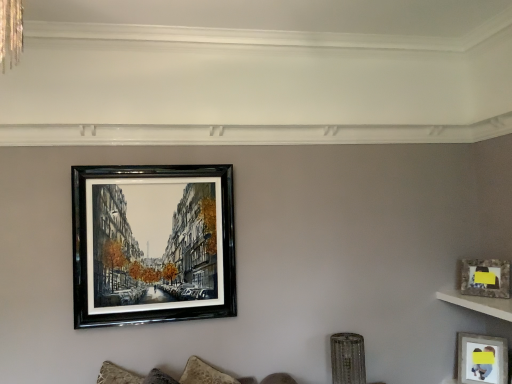
Describe the element at coordinates (485, 278) in the screenshot. This screenshot has width=512, height=384. I see `matte glass picture frame at upper right, the 2th picture frame in the left-to-right sequence` at that location.

This screenshot has width=512, height=384. What do you see at coordinates (482, 359) in the screenshot?
I see `matte gray picture frame at lower right, arranged as the third picture frame when viewed from the left` at bounding box center [482, 359].

The image size is (512, 384). What do you see at coordinates (152, 244) in the screenshot? I see `black glossy picture frame at upper center, the first picture frame positioned from the left` at bounding box center [152, 244].

This screenshot has width=512, height=384. Find the location of `white marble shelf at upper right`. white marble shelf at upper right is located at coordinates (479, 303).

Identify the location of matte glass picture frame at upper right, the second picture frame positioned from the bottom. The image size is (512, 384). (485, 278).

From the image's perspective, who appears lower, matte gray picture frame at lower right, which ranks as the 1th picture frame in bottom-to-top order, or black glossy picture frame at upper center, the 3th picture frame positioned from the bottom?

matte gray picture frame at lower right, which ranks as the 1th picture frame in bottom-to-top order, is shown below in the image.

Between matte gray picture frame at lower right, which ranks as the 3th picture frame in top-to-bottom order, and black glossy picture frame at upper center, the first picture frame from the top, which one appears on the right side from the viewer's perspective?

Positioned to the right is matte gray picture frame at lower right, which ranks as the 3th picture frame in top-to-bottom order.

Measure the distance between matte gray picture frame at lower right, which ranks as the 3th picture frame in top-to-bottom order, and black glossy picture frame at upper center, the 3th picture frame from the right.

matte gray picture frame at lower right, which ranks as the 3th picture frame in top-to-bottom order, and black glossy picture frame at upper center, the 3th picture frame from the right, are 6.75 feet apart.

Considering the positions of objects matte gray picture frame at lower right, arranged as the third picture frame when viewed from the left, and black glossy picture frame at upper center, the 3th picture frame positioned from the bottom, in the image provided, who is behind, matte gray picture frame at lower right, arranged as the third picture frame when viewed from the left, or black glossy picture frame at upper center, the 3th picture frame positioned from the bottom,?

matte gray picture frame at lower right, arranged as the third picture frame when viewed from the left, is further away from the camera.

Considering the sizes of matte gray picture frame at lower right, which ranks as the 1th picture frame in bottom-to-top order, and matte glass picture frame at upper right, the second picture frame positioned from the bottom, in the image, is matte gray picture frame at lower right, which ranks as the 1th picture frame in bottom-to-top order, wider or thinner than matte glass picture frame at upper right, the second picture frame positioned from the bottom,?

In the image, matte gray picture frame at lower right, which ranks as the 1th picture frame in bottom-to-top order, appears to be wider than matte glass picture frame at upper right, the second picture frame positioned from the bottom.

Is matte gray picture frame at lower right, which ranks as the 3th picture frame in top-to-bottom order, next to matte glass picture frame at upper right, placed as the 2th picture frame when sorted from right to left, and touching it?

There is a gap between matte gray picture frame at lower right, which ranks as the 3th picture frame in top-to-bottom order, and matte glass picture frame at upper right, placed as the 2th picture frame when sorted from right to left.

Is matte gray picture frame at lower right, which ranks as the 3th picture frame in top-to-bottom order, located outside matte glass picture frame at upper right, the 2th picture frame viewed from the top?

matte gray picture frame at lower right, which ranks as the 3th picture frame in top-to-bottom order, lies outside matte glass picture frame at upper right, the 2th picture frame viewed from the top,'s area.

Image resolution: width=512 pixels, height=384 pixels. In order to click on picture frame on the right of matte glass picture frame at upper right, the second picture frame positioned from the bottom in this screenshot , I will do `click(482, 359)`.

Is point (499, 266) positioned behind point (160, 176)?

Yes, it is behind point (160, 176).

Is matte glass picture frame at upper right, the 2th picture frame in the left-to-right sequence, further to camera compared to black glossy picture frame at upper center, the first picture frame positioned from the left?

Yes, matte glass picture frame at upper right, the 2th picture frame in the left-to-right sequence, is further from the viewer.

Considering the relative sizes of matte glass picture frame at upper right, the 2th picture frame viewed from the top, and black glossy picture frame at upper center, the 3th picture frame from the right, in the image provided, is matte glass picture frame at upper right, the 2th picture frame viewed from the top, thinner than black glossy picture frame at upper center, the 3th picture frame from the right,?

In fact, matte glass picture frame at upper right, the 2th picture frame viewed from the top, might be wider than black glossy picture frame at upper center, the 3th picture frame from the right.

Between black glossy picture frame at upper center, the 3th picture frame from the right, and matte glass picture frame at upper right, the 2th picture frame in the left-to-right sequence, which one appears on the right side from the viewer's perspective?

Positioned to the right is matte glass picture frame at upper right, the 2th picture frame in the left-to-right sequence.

From a real-world perspective, does black glossy picture frame at upper center, the first picture frame from the top, sit lower than matte glass picture frame at upper right, the 2th picture frame viewed from the top?

No, from a real-world perspective, black glossy picture frame at upper center, the first picture frame from the top, is not below matte glass picture frame at upper right, the 2th picture frame viewed from the top.

Is black glossy picture frame at upper center, the 3th picture frame from the right, completely or partially outside of matte glass picture frame at upper right, the 2th picture frame viewed from the top?

black glossy picture frame at upper center, the 3th picture frame from the right, lies outside matte glass picture frame at upper right, the 2th picture frame viewed from the top,'s area.

Is white marble shelf at upper right oriented away from matte gray picture frame at lower right, arranged as the third picture frame when viewed from the left?

No, white marble shelf at upper right's orientation is not away from matte gray picture frame at lower right, arranged as the third picture frame when viewed from the left.

Which point is more forward, (492, 307) or (475, 369)?

The point (492, 307) is closer to the camera.

From the image's perspective, between white marble shelf at upper right and matte gray picture frame at lower right, arranged as the third picture frame when viewed from the left, which one is located above?

white marble shelf at upper right appears higher in the image.

From the image's perspective, is matte glass picture frame at upper right, the 2th picture frame in the left-to-right sequence, located beneath white marble shelf at upper right?

No.

Looking at this image, which is in front, matte glass picture frame at upper right, the second picture frame positioned from the bottom, or white marble shelf at upper right?

white marble shelf at upper right is closer to the camera.

Which of these two, matte glass picture frame at upper right, the second picture frame positioned from the bottom, or white marble shelf at upper right, is wider?

white marble shelf at upper right is wider.

Does black glossy picture frame at upper center, the first picture frame positioned from the left, have a greater width compared to white marble shelf at upper right?

Incorrect, the width of black glossy picture frame at upper center, the first picture frame positioned from the left, does not surpass that of white marble shelf at upper right.

Could you tell me if black glossy picture frame at upper center, the 3th picture frame from the right, is turned towards white marble shelf at upper right?

No, black glossy picture frame at upper center, the 3th picture frame from the right, is not aimed at white marble shelf at upper right.

In order to click on the 2nd picture frame positioned below the black glossy picture frame at upper center, the first picture frame from the top (from the image's perspective) in this screenshot , I will do `click(482, 359)`.

There is a matte gray picture frame at lower right, arranged as the third picture frame when viewed from the left. What are the coordinates of `the 1st picture frame above it (from the image's perspective)` in the screenshot? It's located at (485, 278).

When comparing their distances from white marble shelf at upper right, does matte glass picture frame at upper right, placed as the 2th picture frame when sorted from right to left, or black glossy picture frame at upper center, the first picture frame from the top, seem closer?

The object closer to white marble shelf at upper right is matte glass picture frame at upper right, placed as the 2th picture frame when sorted from right to left.

When comparing their distances from matte glass picture frame at upper right, the 2th picture frame in the left-to-right sequence, does black glossy picture frame at upper center, the first picture frame positioned from the left, or matte gray picture frame at lower right, arranged as the third picture frame when viewed from the left, seem closer?

matte gray picture frame at lower right, arranged as the third picture frame when viewed from the left, is closer to matte glass picture frame at upper right, the 2th picture frame in the left-to-right sequence.

Estimate the real-world distances between objects in this image. Which object is closer to matte glass picture frame at upper right, the 2th picture frame viewed from the top, white marble shelf at upper right or matte gray picture frame at lower right, which ranks as the 3th picture frame in top-to-bottom order?

white marble shelf at upper right is positioned closer to the anchor matte glass picture frame at upper right, the 2th picture frame viewed from the top.

Which object lies nearer to the anchor point black glossy picture frame at upper center, the first picture frame positioned from the left, matte glass picture frame at upper right, the second picture frame positioned from the bottom, or matte gray picture frame at lower right, which ranks as the 3th picture frame in top-to-bottom order?

Based on the image, matte glass picture frame at upper right, the second picture frame positioned from the bottom, appears to be nearer to black glossy picture frame at upper center, the first picture frame positioned from the left.

Based on their spatial positions, is black glossy picture frame at upper center, the 3th picture frame positioned from the bottom, or matte glass picture frame at upper right, the 2th picture frame in the left-to-right sequence, further from matte gray picture frame at lower right, which ranks as the 3th picture frame in top-to-bottom order?

black glossy picture frame at upper center, the 3th picture frame positioned from the bottom, is positioned further to the anchor matte gray picture frame at lower right, which ranks as the 3th picture frame in top-to-bottom order.

From the image, which object appears to be nearer to white marble shelf at upper right, matte gray picture frame at lower right, the first picture frame viewed from the right, or matte glass picture frame at upper right, the 2th picture frame in the left-to-right sequence?

matte glass picture frame at upper right, the 2th picture frame in the left-to-right sequence, lies closer to white marble shelf at upper right than the other object.

Based on their spatial positions, is white marble shelf at upper right or matte gray picture frame at lower right, arranged as the third picture frame when viewed from the left, closer to black glossy picture frame at upper center, the first picture frame from the top?

white marble shelf at upper right.

Based on their spatial positions, is white marble shelf at upper right or matte glass picture frame at upper right, the 2th picture frame viewed from the top, further from black glossy picture frame at upper center, the first picture frame from the top?

matte glass picture frame at upper right, the 2th picture frame viewed from the top, is further to black glossy picture frame at upper center, the first picture frame from the top.

I want to click on shelf located between black glossy picture frame at upper center, the 3th picture frame from the right, and matte gray picture frame at lower right, which ranks as the 3th picture frame in top-to-bottom order, in the left-right direction, so click(x=479, y=303).

Where is `shelf situated between black glossy picture frame at upper center, the first picture frame positioned from the left, and matte glass picture frame at upper right, the second picture frame positioned from the bottom, from left to right`? This screenshot has height=384, width=512. shelf situated between black glossy picture frame at upper center, the first picture frame positioned from the left, and matte glass picture frame at upper right, the second picture frame positioned from the bottom, from left to right is located at coordinates (479, 303).

What are the coordinates of `shelf between matte glass picture frame at upper right, the 2th picture frame viewed from the top, and matte gray picture frame at lower right, arranged as the third picture frame when viewed from the left, vertically` in the screenshot? It's located at (479, 303).

Locate an element on the screen. This screenshot has width=512, height=384. picture frame between black glossy picture frame at upper center, the 3th picture frame positioned from the bottom, and matte gray picture frame at lower right, arranged as the third picture frame when viewed from the left, from left to right is located at coordinates (485, 278).